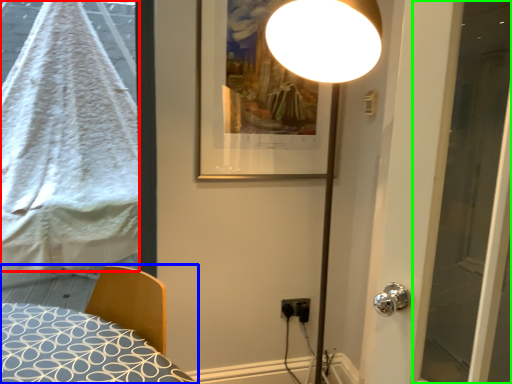
Question: Based on their relative distances, which object is nearer to blanket (highlighted by a red box)? Choose from bed (highlighted by a blue box) and screen door (highlighted by a green box).

Choices:
 (A) bed
 (B) screen door

Answer: (A)